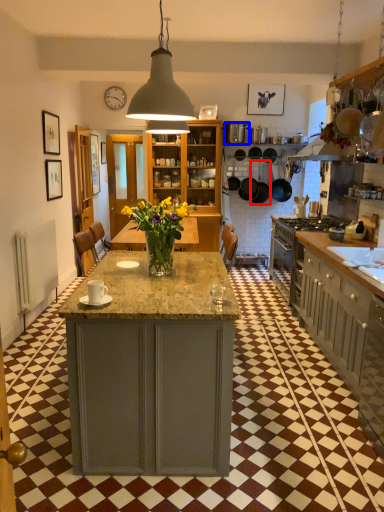
Question: Which of the following is the farthest to the observer, frying pan (highlighted by a red box) or kitchen appliance (highlighted by a blue box)?

Choices:
 (A) frying pan
 (B) kitchen appliance

Answer: (A)